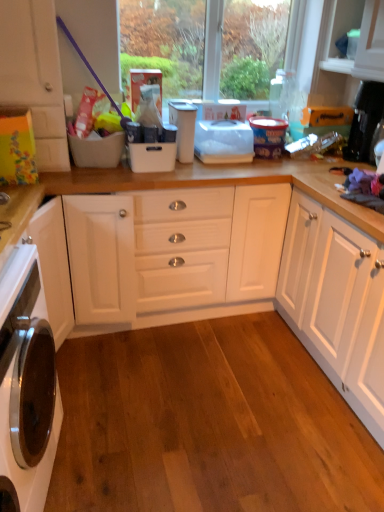
What is the approximate width of white matte cabinet at left?

white matte cabinet at left is 19.14 inches wide.

Locate an element on the screen. The height and width of the screenshot is (512, 384). white plastic container at center is located at coordinates (183, 128).

What is the approximate width of white plastic container at center?

It is 6.83 inches.

Image resolution: width=384 pixels, height=512 pixels. I want to click on white matte cabinet at left, so click(x=35, y=75).

From the image's perspective, which is below, transparent plastic window screen at upper center or white glossy oven at lower left?

white glossy oven at lower left is shown below in the image.

From the picture: Is transparent plastic window screen at upper center to the right of white glossy oven at lower left from the viewer's perspective?

Indeed, transparent plastic window screen at upper center is positioned on the right side of white glossy oven at lower left.

Considering the points (158, 35) and (50, 369), which point is in front, point (158, 35) or point (50, 369)?

The point (50, 369) is in front.

In terms of height, does white matte cabinet at left look taller or shorter compared to white plastic container at center?

In the image, white matte cabinet at left appears to be taller than white plastic container at center.

Between white matte cabinet at left and white plastic container at center, which one has larger width?

With larger width is white matte cabinet at left.

Is white plastic container at center inside white matte cabinet at left?

No.

Can you confirm if white matte cabinet at left is bigger than white plastic container at center?

Yes, white matte cabinet at left is bigger than white plastic container at center.

From a real-world perspective, is white plastic container at center under white matte cabinet at left?

Yes, from a real-world perspective, white plastic container at center is below white matte cabinet at left.

Is point (193, 129) positioned in front of point (6, 36)?

No.

Between white plastic container at center and white matte cabinet at left, which one has larger width?

white matte cabinet at left.

Where is `appliance below the white matte cabinet at left (from the image's perspective)`? appliance below the white matte cabinet at left (from the image's perspective) is located at coordinates (183, 128).

Is white plastic container at center taller or shorter than white glossy oven at lower left?

Considering their sizes, white plastic container at center has less height than white glossy oven at lower left.

The image size is (384, 512). What are the coordinates of `home appliance directly beneath the white plastic container at center (from a real-world perspective)` in the screenshot? It's located at point(27,383).

Is white plastic container at center to the right of white glossy oven at lower left from the viewer's perspective?

Yes.

From the picture: Is there a large distance between white plastic container at center and white glossy oven at lower left?

white plastic container at center is positioned a significant distance from white glossy oven at lower left.

Considering the relative sizes of white glossy oven at lower left and white plastic container at center in the image provided, is white glossy oven at lower left smaller than white plastic container at center?

Actually, white glossy oven at lower left might be larger than white plastic container at center.

Is white plastic container at center at the back of white glossy oven at lower left?

No.

From a real-world perspective, is white glossy oven at lower left below white plastic container at center?

Yes, from a real-world perspective, white glossy oven at lower left is below white plastic container at center.

From a real-world perspective, is white glossy oven at lower left located higher than white matte cabinet at left?

Actually, white glossy oven at lower left is physically below white matte cabinet at left in the real world.

Does white glossy oven at lower left have a greater height compared to white matte cabinet at left?

Correct, white glossy oven at lower left is much taller as white matte cabinet at left.

Could white matte cabinet at left be considered to be inside white glossy oven at lower left?

No, white matte cabinet at left is not a part of white glossy oven at lower left.

Is white glossy oven at lower left facing towards transparent plastic window screen at upper center?

No, white glossy oven at lower left is not facing towards transparent plastic window screen at upper center.

Looking at this image, which object is further away from the camera taking this photo, white glossy oven at lower left or transparent plastic window screen at upper center?

transparent plastic window screen at upper center is further away from the camera.

Which of these two, white glossy oven at lower left or transparent plastic window screen at upper center, is bigger?

white glossy oven at lower left is bigger.

Is white glossy oven at lower left in contact with transparent plastic window screen at upper center?

There is a gap between white glossy oven at lower left and transparent plastic window screen at upper center.

Where is `window screen on the right of white glossy oven at lower left`? The height and width of the screenshot is (512, 384). window screen on the right of white glossy oven at lower left is located at coordinates (204, 45).

Where is `cabinetry on the left side of white plastic container at center`? This screenshot has height=512, width=384. cabinetry on the left side of white plastic container at center is located at coordinates (35, 75).

When comparing their distances from transparent plastic window screen at upper center, does white plastic container at center or white matte cabinet at left seem further?

Among the two, white matte cabinet at left is located further to transparent plastic window screen at upper center.

From the image, which object appears to be farther from white plastic container at center, white glossy oven at lower left or white matte cabinet at left?

white glossy oven at lower left is further to white plastic container at center.

Considering their positions, is white plastic container at center positioned closer to transparent plastic window screen at upper center than white glossy oven at lower left?

The object closer to transparent plastic window screen at upper center is white plastic container at center.

Which object lies further to the anchor point transparent plastic window screen at upper center, white matte cabinet at left or white glossy oven at lower left?

white glossy oven at lower left is positioned further to the anchor transparent plastic window screen at upper center.

Considering their positions, is white glossy oven at lower left positioned closer to white matte cabinet at left than white plastic container at center?

Based on the image, white plastic container at center appears to be nearer to white matte cabinet at left.

Estimate the real-world distances between objects in this image. Which object is further from white glossy oven at lower left, white plastic container at center or white matte cabinet at left?

white plastic container at center.

Looking at the image, which one is located further to white glossy oven at lower left, transparent plastic window screen at upper center or white matte cabinet at left?

transparent plastic window screen at upper center is further to white glossy oven at lower left.

Based on their spatial positions, is white glossy oven at lower left or transparent plastic window screen at upper center further from white matte cabinet at left?

white glossy oven at lower left.

Where is `cabinetry between transparent plastic window screen at upper center and white glossy oven at lower left from top to bottom`? This screenshot has width=384, height=512. cabinetry between transparent plastic window screen at upper center and white glossy oven at lower left from top to bottom is located at coordinates (35, 75).

The image size is (384, 512). What are the coordinates of `appliance between white matte cabinet at left and transparent plastic window screen at upper center` in the screenshot? It's located at (183, 128).

Identify the location of appliance that lies between transparent plastic window screen at upper center and white glossy oven at lower left from top to bottom. (183, 128).

Locate an element on the screen. The width and height of the screenshot is (384, 512). appliance between white matte cabinet at left and white glossy oven at lower left vertically is located at coordinates click(x=183, y=128).